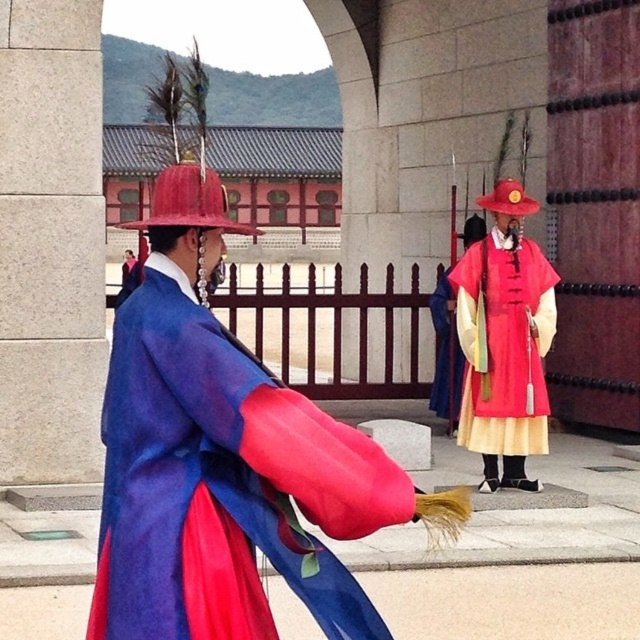
You are a photographer at this cultural event and need to capture both the matte blue silk robe at center and the matte red and yellow robe at center in a single frame. Since the camera has a limited focus area, which robe should you prioritize to ensure it is fully visible?

The matte blue silk robe at center is bigger than the matte red and yellow robe at center, so you should prioritize capturing the matte blue silk robe at center to ensure it fits within the camera frame.

You are an event planner arranging a photo shoot in the palace setting. You need to position two models wearing the matte blue silk robe at center and the matte red and yellow robe at center. According to the scene, which robe should be placed closer to the camera to maintain the original composition?

The matte blue silk robe at center should be placed closer to the camera since it is in front of the matte red and yellow robe at center in the original scene.